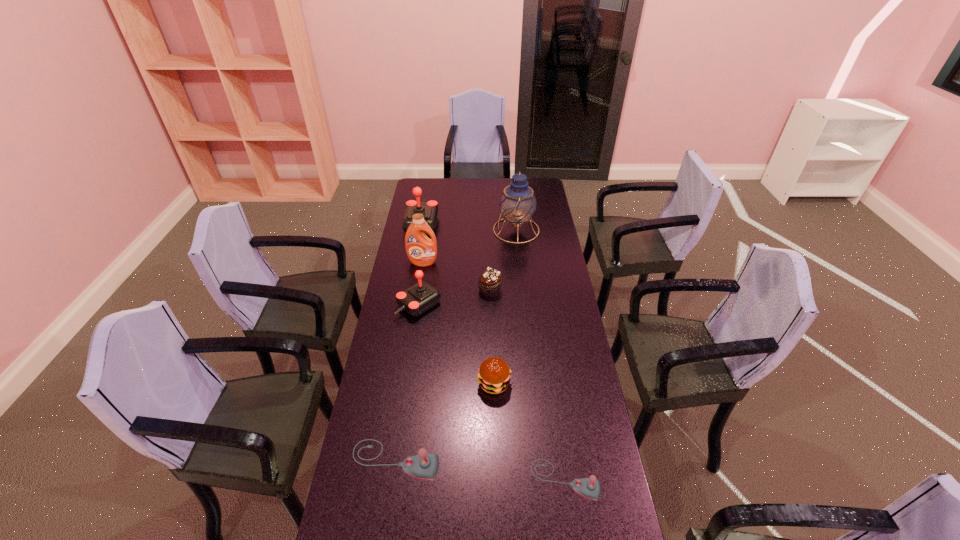
Identify the location of vacant space in between the lantern and the farther red joystick. (469, 226).

Locate an element on the screen. The height and width of the screenshot is (540, 960). free space that is in between the rightmost joystick and the hamburger is located at coordinates pos(530,432).

This screenshot has height=540, width=960. I want to click on empty space between the farthest joystick and the hamburger, so click(458, 302).

At what (x,y) coordinates should I click in order to perform the action: click on vacant space that is in between the blue lantern and the bigger red joystick. Please return your answer as a coordinate pair (x, y). Looking at the image, I should click on (469, 226).

The image size is (960, 540). Identify the location of free space between the cupcake and the shortest object. (527, 386).

Find the location of a particular element. This screenshot has height=540, width=960. unoccupied position between the brown cupcake and the shortest joystick is located at coordinates (527, 386).

Find the location of a particular element. object that is the second nearest to the blue lantern is located at coordinates (490, 281).

Locate an element on the screen. object that is the fourth closest one to the second tallest object is located at coordinates (518, 203).

Choose which joystick is the fourth nearest neighbor to the brown cupcake. Please provide its 2D coordinates. Your answer should be formatted as a tuple, i.e. [(x, y)], where the tuple contains the x and y coordinates of a point satisfying the conditions above.

[(590, 488)]

Find the location of a particular element. The width and height of the screenshot is (960, 540). joystick that is the third closest to the third shortest joystick is located at coordinates (590, 488).